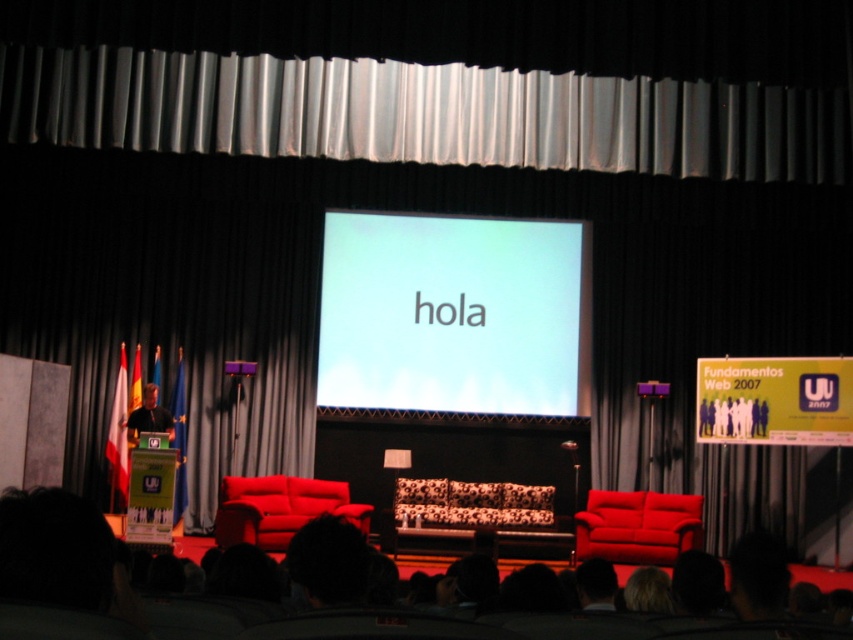
Which is in front, point (357, 244) or point (143, 392)?

Point (143, 392)

Does white glossy projection screen at center have a lesser height compared to matte black podium at left?

In fact, white glossy projection screen at center may be taller than matte black podium at left.

Locate an element on the screen. The height and width of the screenshot is (640, 853). white glossy projection screen at center is located at coordinates (451, 314).

Find the location of `white glossy projection screen at center`. white glossy projection screen at center is located at coordinates (451, 314).

Can you confirm if dark hair at center is positioned to the right of matte black podium at left?

Yes, dark hair at center is to the right of matte black podium at left.

Can you confirm if dark hair at center is positioned below matte black podium at left?

Incorrect, dark hair at center is not positioned below matte black podium at left.

Is point (82, 573) farther from camera compared to point (155, 392)?

That is False.

The image size is (853, 640). I want to click on dark hair at center, so click(55, 568).

Who is lower down, white glossy projection screen at center or dark hair at center?

dark hair at center is lower down.

Is point (386, 368) farther from viewer compared to point (526, 636)?

Yes, it is behind point (526, 636).

Which is behind, point (463, 237) or point (287, 637)?

Positioned behind is point (463, 237).

At what (x,y) coordinates should I click in order to perform the action: click on white glossy projection screen at center. Please return your answer as a coordinate pair (x, y). This screenshot has height=640, width=853. Looking at the image, I should click on (451, 314).